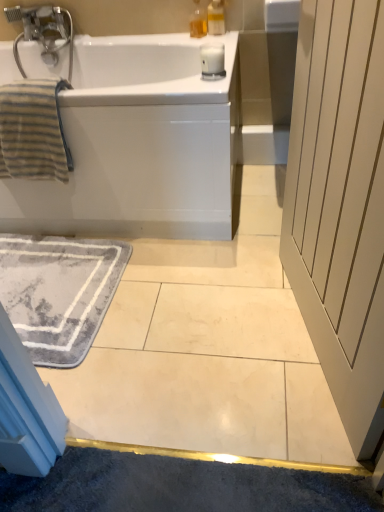
The height and width of the screenshot is (512, 384). In order to click on vacant space to the right of gray soft rug at lower left in this screenshot , I will do `click(186, 308)`.